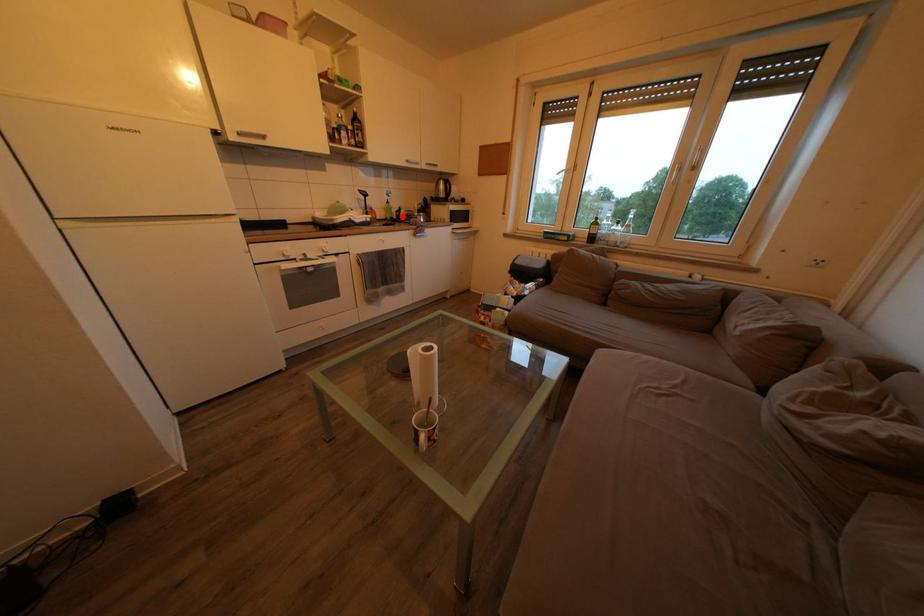
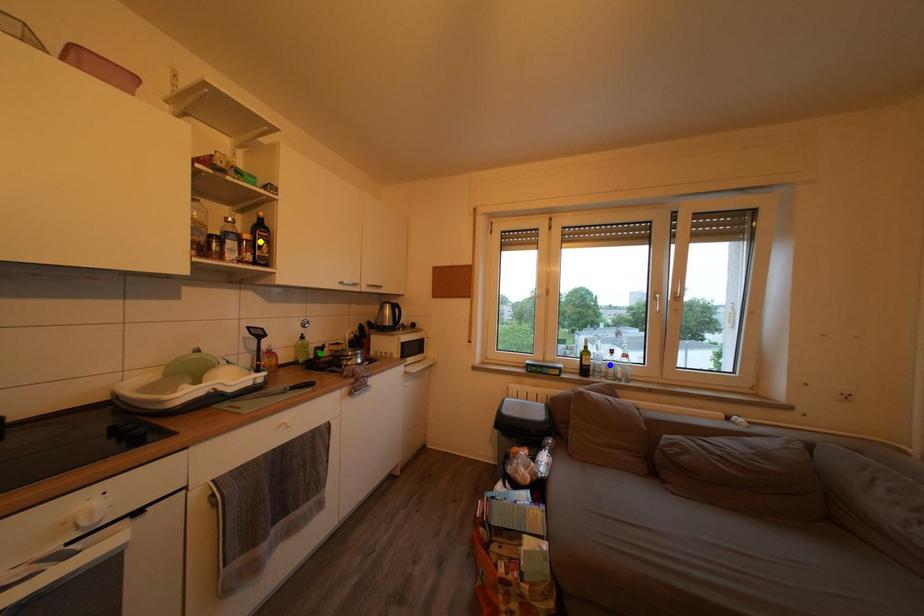
Question: I am providing you with two images of the same scene from different viewpoints. A red point is marked on the first image. You are given multiple points on the second image. In image 2, which mark is for the same physical point as the one in image 1?

Choices:
 (A) green point
 (B) yellow point
 (C) blue point

Answer: (A)